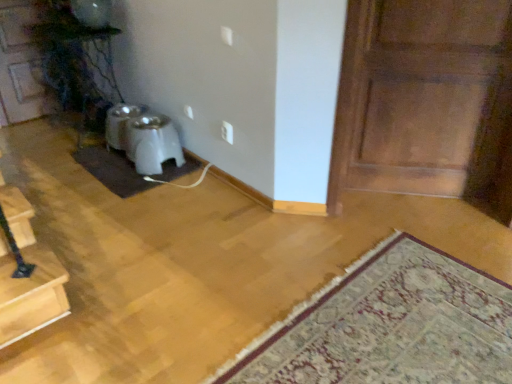
Question: Based on their sizes in the image, would you say white plastic pet feeder at center is bigger or smaller than wooden panel door at right, marked as the 2th door in a back-to-front arrangement?

Choices:
 (A) small
 (B) big

Answer: (A)

Question: From their relative heights in the image, would you say white plastic pet feeder at center is taller or shorter than wooden panel door at right, marked as the 1th door in a front-to-back arrangement?

Choices:
 (A) short
 (B) tall

Answer: (A)

Question: Estimate the real-world distances between objects in this image. Which object is farther from the carpeted rug at lower right?

Choices:
 (A) brown felt doormat at lower left
 (B) wooden panel door at right, the 2th door in the left-to-right sequence
 (C) white plastic electric outlet at center
 (D) white plastic pet feeder at center
 (E) wooden door at upper left, which is the second door from front to back

Answer: (E)

Question: Based on their relative distances, which object is nearer to the wooden door at upper left, which is the second door from front to back?

Choices:
 (A) wooden panel door at right, the 2th door in the left-to-right sequence
 (B) white plastic pet feeder at center
 (C) brown felt doormat at lower left
 (D) carpeted rug at lower right
 (E) white plastic electric outlet at center

Answer: (C)